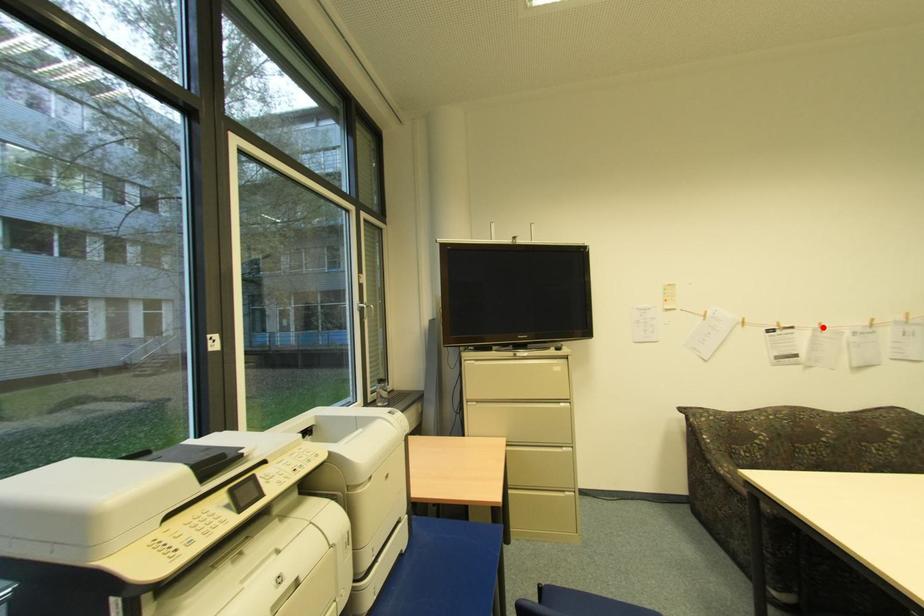
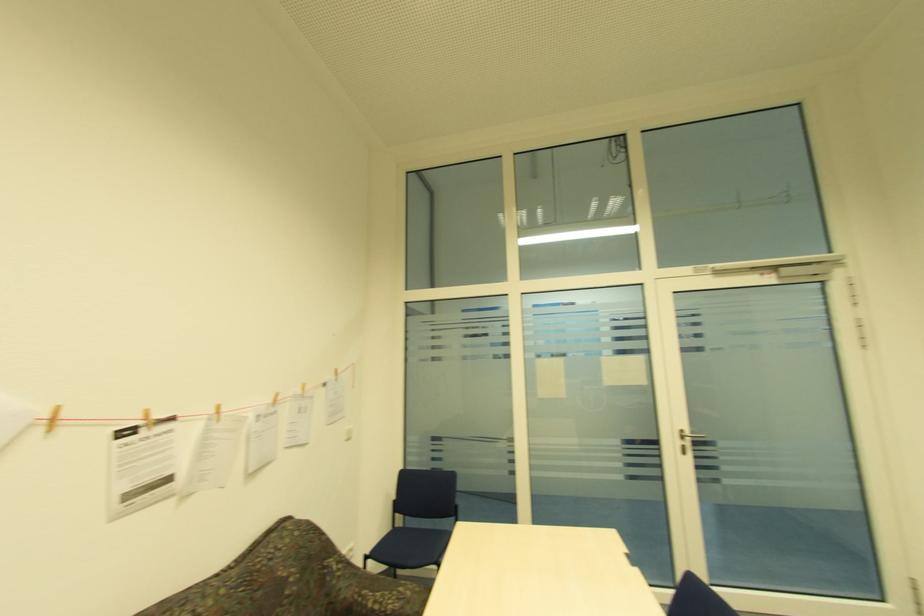
Question: I am providing you with two images of the same scene from different viewpoints. A red point is marked on the first image. At the location where the point appears in image 1, is it still visible in image 2?

Choices:
 (A) Yes
 (B) No

Answer: (A)